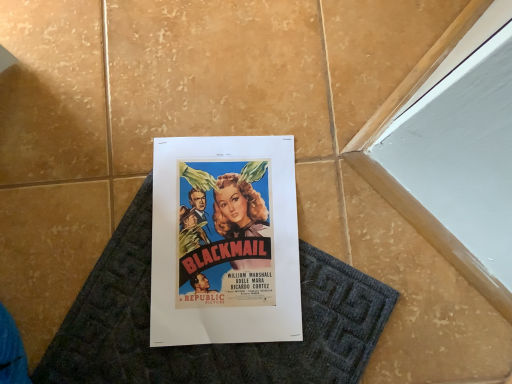
Question: Visually, is matte paper poster at center positioned to the left or to the right of dark gray textured bath mat at center?

Choices:
 (A) right
 (B) left

Answer: (B)

Question: Considering the positions of point (287, 336) and point (80, 352), is point (287, 336) closer or farther from the camera than point (80, 352)?

Choices:
 (A) closer
 (B) farther

Answer: (B)

Question: From the image's perspective, is matte paper poster at center above or below dark gray textured bath mat at center?

Choices:
 (A) above
 (B) below

Answer: (A)

Question: From the image's perspective, is dark gray textured bath mat at center above or below matte paper poster at center?

Choices:
 (A) below
 (B) above

Answer: (A)

Question: Is point (68, 327) positioned closer to the camera than point (293, 198)?

Choices:
 (A) farther
 (B) closer

Answer: (B)

Question: Is dark gray textured bath mat at center taller or shorter than matte paper poster at center?

Choices:
 (A) short
 (B) tall

Answer: (A)

Question: In the image, is dark gray textured bath mat at center positioned in front of or behind matte paper poster at center?

Choices:
 (A) behind
 (B) front

Answer: (B)